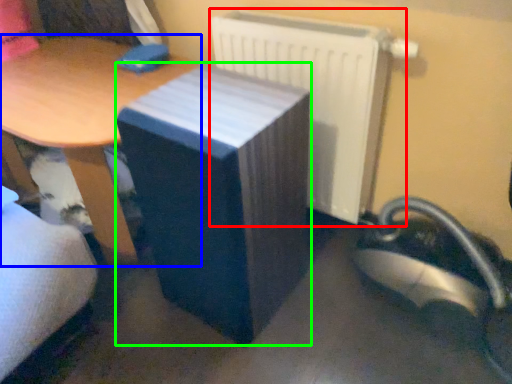
Question: Considering the real-world distances, which object is farthest from radiator (highlighted by a red box)? table (highlighted by a blue box) or table (highlighted by a green box)?

Choices:
 (A) table
 (B) table

Answer: (A)